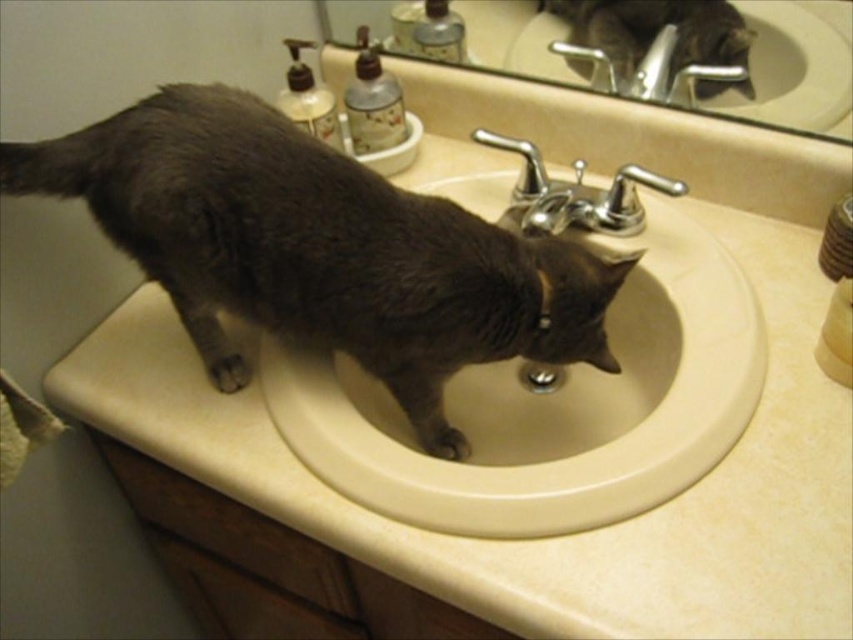
Does dark gray fur at sink come behind beige ceramic sink at center?

No, it is not.

Does dark gray fur at sink have a larger size compared to beige ceramic sink at center?

Actually, dark gray fur at sink might be smaller than beige ceramic sink at center.

Between point (546, 248) and point (486, 371), which one is positioned behind?

The point (486, 371) is more distant.

Locate an element on the screen. dark gray fur at sink is located at coordinates (318, 248).

Does beige ceramic sink at center have a greater height compared to gray fur cat at sink center?

Yes, beige ceramic sink at center is taller than gray fur cat at sink center.

Does beige ceramic sink at center have a larger size compared to gray fur cat at sink center?

Yes.

Is point (721, 298) positioned behind point (700, 84)?

No, (721, 298) is in front of (700, 84).

Where is `beige ceramic sink at center`? This screenshot has height=640, width=853. beige ceramic sink at center is located at coordinates (550, 406).

Is point (148, 113) farther from viewer compared to point (825, 12)?

No, (148, 113) is in front of (825, 12).

Is dark gray fur at sink to the left of gray fur cat at sink center from the viewer's perspective?

Correct, you'll find dark gray fur at sink to the left of gray fur cat at sink center.

Between point (442, 227) and point (796, 81), which one is positioned in front?

Positioned in front is point (442, 227).

Locate an element on the screen. The image size is (853, 640). dark gray fur at sink is located at coordinates (318, 248).